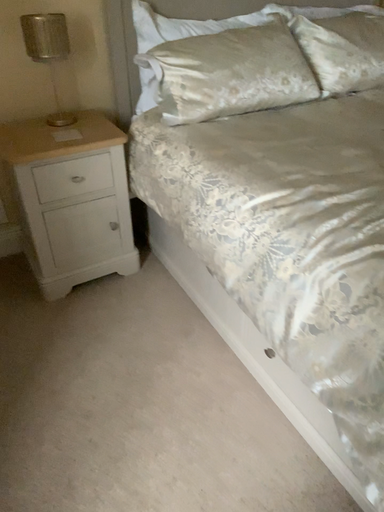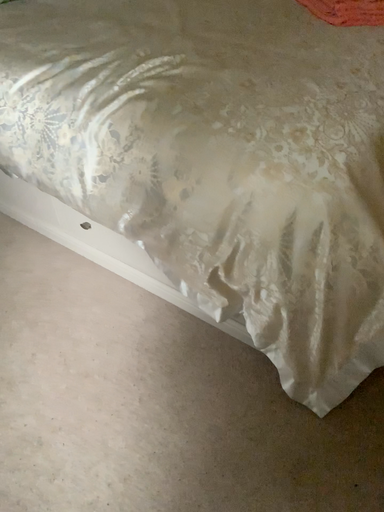
Question: Which way did the camera rotate in the video?

Choices:
 (A) rotated left
 (B) rotated right

Answer: (B)